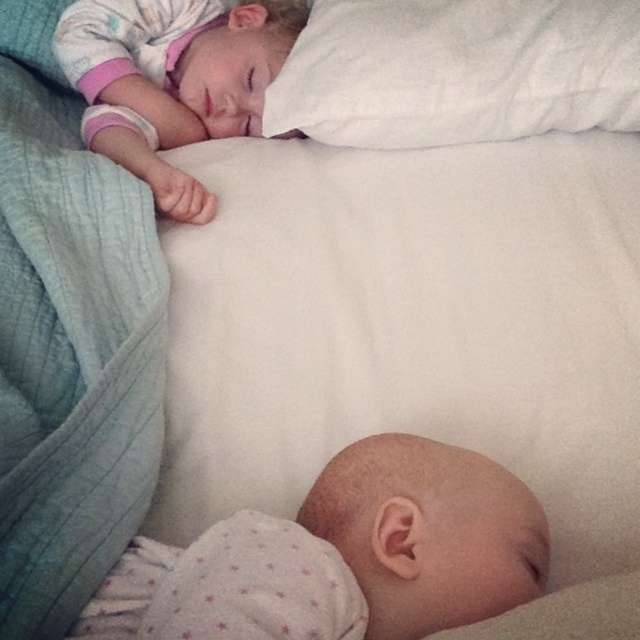
Does white soft pillow at upper center have a smaller size compared to matte white pillow at upper center?

Correct, white soft pillow at upper center occupies less space than matte white pillow at upper center.

Does white soft pillow at upper center have a lesser width compared to matte white pillow at upper center?

Incorrect, white soft pillow at upper center's width is not less than matte white pillow at upper center's.

Does point (454, 83) come closer to viewer compared to point (84, 88)?

Yes, it is in front of point (84, 88).

Locate an element on the screen. This screenshot has height=640, width=640. white soft pillow at upper center is located at coordinates (458, 72).

Is teal quilted blanket at left smaller than white soft pillow at upper center?

Incorrect, teal quilted blanket at left is not smaller in size than white soft pillow at upper center.

Who is taller, teal quilted blanket at left or white soft pillow at upper center?

With more height is teal quilted blanket at left.

Which is in front, point (17, 371) or point (392, 38)?

Point (17, 371) is more forward.

Find the location of a particular element. This screenshot has width=640, height=640. teal quilted blanket at left is located at coordinates (70, 358).

Is point (58, 160) closer to viewer compared to point (170, 202)?

Yes.

Does teal quilted blanket at left appear over matte white pillow at upper center?

No, teal quilted blanket at left is not above matte white pillow at upper center.

Measure the distance between teal quilted blanket at left and camera.

teal quilted blanket at left and camera are 19.31 inches apart.

Where is `teal quilted blanket at left`? The image size is (640, 640). teal quilted blanket at left is located at coordinates (70, 358).